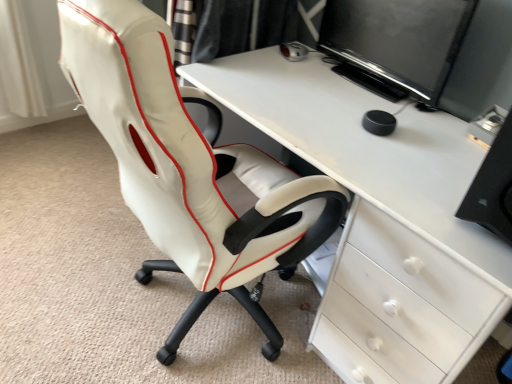
Find the location of a particular element. The height and width of the screenshot is (384, 512). black plastic computer tower at right is located at coordinates (493, 183).

Image resolution: width=512 pixels, height=384 pixels. Describe the element at coordinates (189, 167) in the screenshot. I see `white leather chair at center` at that location.

What is the approximate width of black glossy monitor at upper right?

7.25 centimeters.

In order to click on black plastic computer tower at right in this screenshot , I will do `click(493, 183)`.

Which of these two, white glossy desk at center or black plastic computer tower at right, stands shorter?

Standing shorter between the two is black plastic computer tower at right.

Is white glossy desk at center oriented away from black plastic computer tower at right?

No, white glossy desk at center's orientation is not away from black plastic computer tower at right.

Between white glossy desk at center and black plastic computer tower at right, which one has smaller size?

Smaller between the two is black plastic computer tower at right.

How much distance is there between black plastic computer tower at right and black glossy monitor at upper right?

They are 25.75 inches apart.

Is black plastic computer tower at right with black glossy monitor at upper right?

No.

From the image's perspective, is black plastic computer tower at right on black glossy monitor at upper right?

No, from the image's perspective, black plastic computer tower at right is not above black glossy monitor at upper right.

Is black glossy monitor at upper right at the back of black plastic computer tower at right?

No.

Can you confirm if black glossy monitor at upper right is taller than white leather chair at center?

No, black glossy monitor at upper right is not taller than white leather chair at center.

Is black glossy monitor at upper right far away from white leather chair at center?

black glossy monitor at upper right is near white leather chair at center, not far away.

Is black glossy monitor at upper right not inside white leather chair at center?

Yes, black glossy monitor at upper right is located beyond the bounds of white leather chair at center.

In terms of width, does black glossy monitor at upper right look wider or thinner when compared to white leather chair at center?

Clearly, black glossy monitor at upper right has less width compared to white leather chair at center.

Which is farther, (400, 43) or (337, 344)?

The point (400, 43) is farther from the camera.

Considering the sizes of objects black glossy monitor at upper right and white glossy desk at center in the image provided, who is wider, black glossy monitor at upper right or white glossy desk at center?

white glossy desk at center.

Locate an element on the screen. The image size is (512, 384). desk in front of the black glossy monitor at upper right is located at coordinates (381, 219).

How far apart are black glossy monitor at upper right and white glossy desk at center?

A distance of 14.22 inches exists between black glossy monitor at upper right and white glossy desk at center.

Considering the relative positions of white glossy desk at center and white leather chair at center in the image provided, is white glossy desk at center to the left or to the right of white leather chair at center?

Clearly, white glossy desk at center is on the right of white leather chair at center in the image.

Is white glossy desk at center oriented towards white leather chair at center?

Yes.

From the image's perspective, is white glossy desk at center below white leather chair at center?

Correct, white glossy desk at center appears lower than white leather chair at center in the image.

Based on the photo, is white glossy desk at center wider or thinner than white leather chair at center?

Considering their sizes, white glossy desk at center looks slimmer than white leather chair at center.

Which point is more forward, (143, 104) or (467, 267)?

Point (143, 104)

Which object is wider, white leather chair at center or white glossy desk at center?

white leather chair at center.

Locate an element on the screen. Image resolution: width=512 pixels, height=384 pixels. chair that appears above the white glossy desk at center (from a real-world perspective) is located at coordinates (189, 167).

Can you confirm if white leather chair at center is smaller than white glossy desk at center?

Correct, white leather chair at center occupies less space than white glossy desk at center.

Is black plastic computer tower at right bigger or smaller than white glossy desk at center?

Clearly, black plastic computer tower at right is smaller in size than white glossy desk at center.

Is black plastic computer tower at right far away from white glossy desk at center?

No.

Is black plastic computer tower at right surrounding white glossy desk at center?

Definitely not — white glossy desk at center is not inside black plastic computer tower at right.

Locate an element on the screen. This screenshot has width=512, height=384. computer tower that appears above the white glossy desk at center (from the image's perspective) is located at coordinates (493, 183).

Locate an element on the screen. The height and width of the screenshot is (384, 512). computer tower in front of the black glossy monitor at upper right is located at coordinates (493, 183).

Looking at the image, which one is located closer to black glossy monitor at upper right, white leather chair at center or white glossy desk at center?

Based on the image, white glossy desk at center appears to be nearer to black glossy monitor at upper right.

Which object lies further to the anchor point white leather chair at center, black glossy monitor at upper right or black plastic computer tower at right?

The object further to white leather chair at center is black glossy monitor at upper right.

Looking at the image, which one is located further to white glossy desk at center, white leather chair at center or black plastic computer tower at right?

black plastic computer tower at right is positioned further to the anchor white glossy desk at center.

When comparing their distances from black plastic computer tower at right, does white leather chair at center or black glossy monitor at upper right seem closer?

white leather chair at center is closer to black plastic computer tower at right.

Based on their spatial positions, is white leather chair at center or black plastic computer tower at right further from black glossy monitor at upper right?

white leather chair at center lies further to black glossy monitor at upper right than the other object.

From the image, which object appears to be nearer to white leather chair at center, white glossy desk at center or black plastic computer tower at right?

white glossy desk at center is positioned closer to the anchor white leather chair at center.

Which object lies nearer to the anchor point black glossy monitor at upper right, black plastic computer tower at right or white leather chair at center?

black plastic computer tower at right.

Based on their spatial positions, is black glossy monitor at upper right or white leather chair at center closer to black plastic computer tower at right?

white leather chair at center lies closer to black plastic computer tower at right than the other object.

I want to click on computer tower between black glossy monitor at upper right and white glossy desk at center from top to bottom, so click(493, 183).

At what (x,y) coordinates should I click in order to perform the action: click on computer monitor located between white leather chair at center and black plastic computer tower at right in the left-right direction. Please return your answer as a coordinate pair (x, y). Looking at the image, I should click on (398, 39).

Locate an element on the screen. This screenshot has width=512, height=384. chair between black glossy monitor at upper right and white glossy desk at center vertically is located at coordinates (189, 167).

The height and width of the screenshot is (384, 512). I want to click on desk between white leather chair at center and black plastic computer tower at right in the horizontal direction, so click(x=381, y=219).